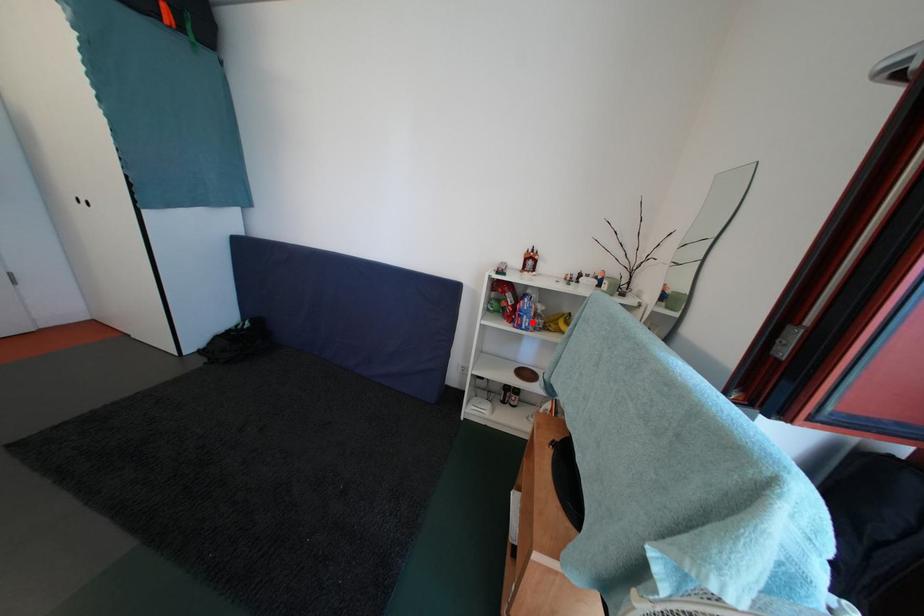
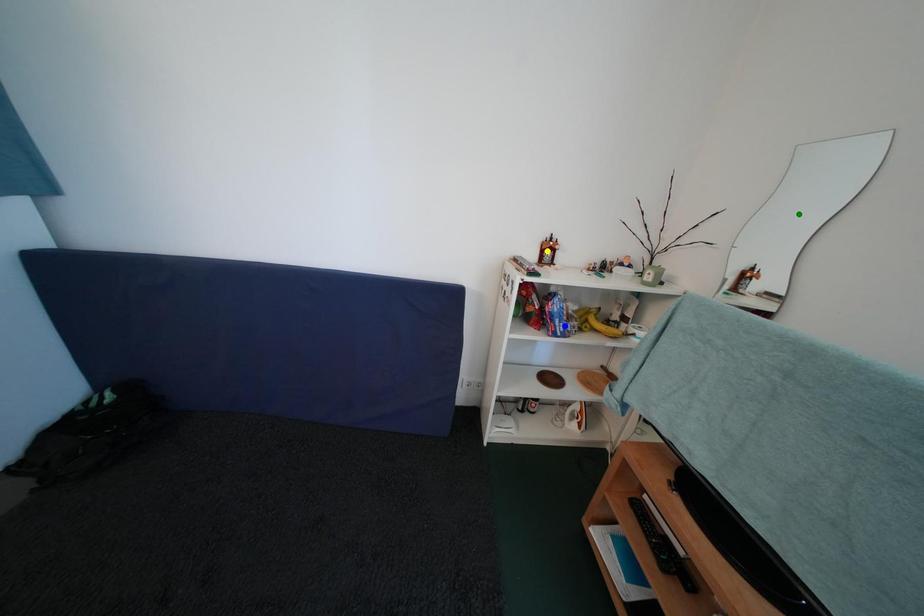
Question: I am providing you with two images of the same scene from different viewpoints. A red point is marked on the first image. You are given multiple points on the second image. Which point in image 2 is actually the same real-world point as the red point in image 1?

Choices:
 (A) blue point
 (B) yellow point
 (C) green point

Answer: (A)